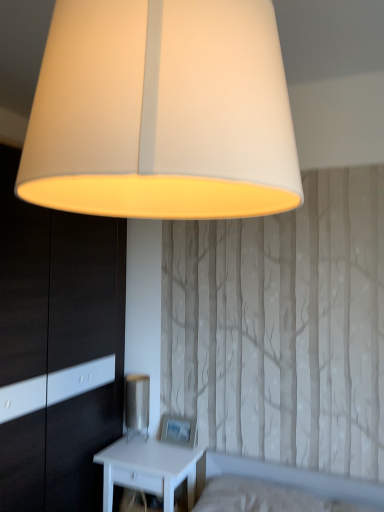
Question: Is point (152, 457) closer or farther from the camera than point (135, 429)?

Choices:
 (A) farther
 (B) closer

Answer: (B)

Question: Which is correct: white matte nightstand at lower left is inside metallic silver table lamp at lower center, or outside of it?

Choices:
 (A) inside
 (B) outside

Answer: (B)

Question: Based on their relative distances, which object is nearer to the metallic silver table lamp at lower center?

Choices:
 (A) white glossy dresser at left
 (B) matte white lampshade at upper center
 (C) white matte nightstand at lower left

Answer: (C)

Question: Estimate the real-world distances between objects in this image. Which object is closer to the metallic silver table lamp at lower center?

Choices:
 (A) matte white lampshade at upper center
 (B) white glossy dresser at left
 (C) white matte nightstand at lower left

Answer: (C)